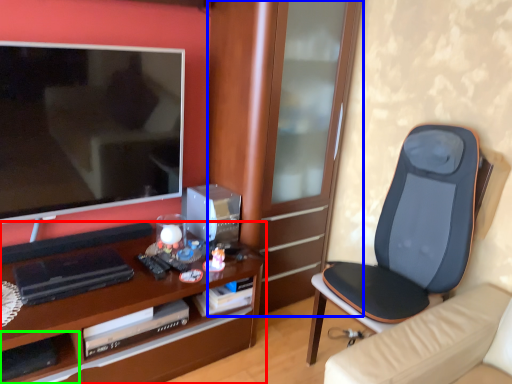
Question: Estimate the real-world distances between objects in this image. Which object is farther from desk (highlighted by a red box), cabinetry (highlighted by a blue box) or shelf (highlighted by a green box)?

Choices:
 (A) cabinetry
 (B) shelf

Answer: (A)